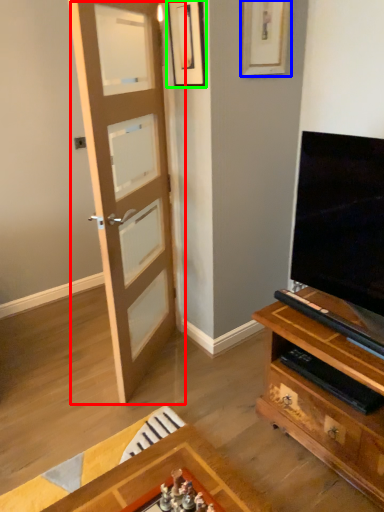
Question: Based on their relative distances, which object is nearer to door (highlighted by a red box)? Choose from picture frame (highlighted by a blue box) and picture frame (highlighted by a green box).

Choices:
 (A) picture frame
 (B) picture frame

Answer: (B)